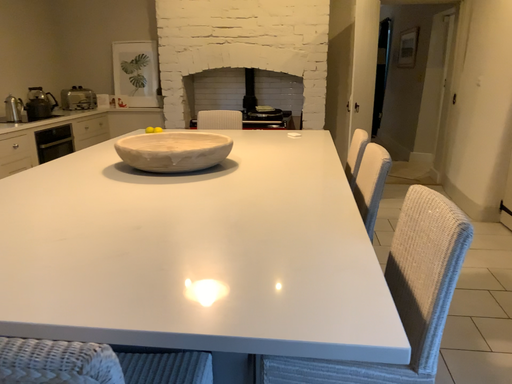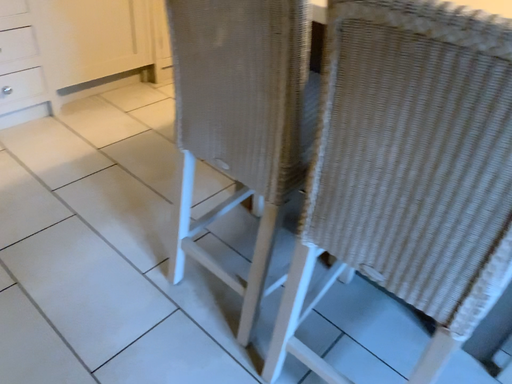
Question: How did the camera likely rotate when shooting the video?

Choices:
 (A) rotated left
 (B) rotated right

Answer: (A)